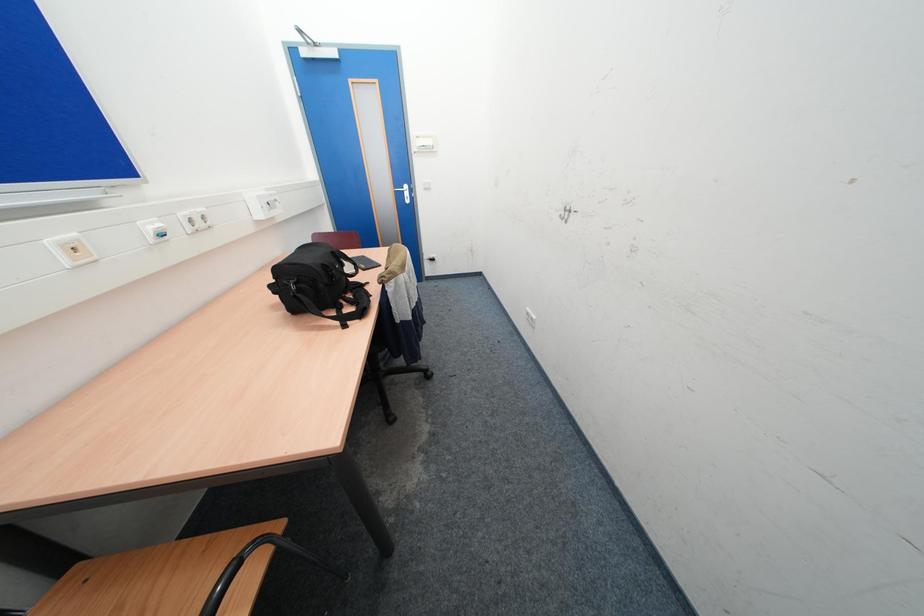
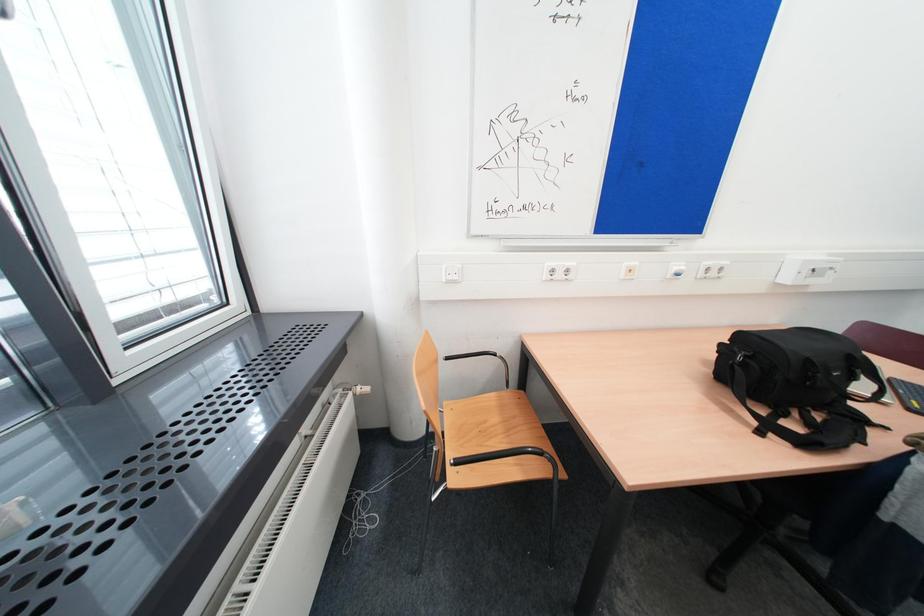
The images are taken continuously from a first-person perspective. In which direction is your viewpoint rotating?

The rotation direction of the camera is left-down.